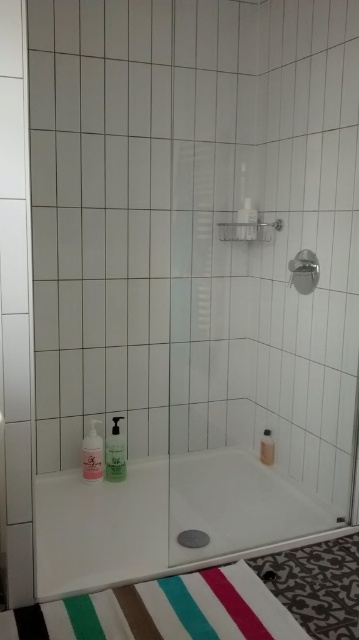
Is white glossy bathtub at lower center behind metallic silver showerhead at upper right?

That is False.

Does white glossy bathtub at lower center have a lesser width compared to metallic silver showerhead at upper right?

Incorrect, white glossy bathtub at lower center's width is not less than metallic silver showerhead at upper right's.

Is point (212, 532) behind point (300, 256)?

No.

The width and height of the screenshot is (359, 640). Identify the location of white glossy bathtub at lower center. (166, 518).

Does translucent plastic soap dispenser at lower left appear under translucent plastic soap dispenser at lower center?

Incorrect, translucent plastic soap dispenser at lower left is not positioned below translucent plastic soap dispenser at lower center.

Does point (89, 433) come closer to viewer compared to point (267, 445)?

Yes, point (89, 433) is in front of point (267, 445).

Identify the location of translucent plastic soap dispenser at lower left. This screenshot has width=359, height=640. [x=91, y=452].

Between metallic silver showerhead at upper right and translucent plastic soap dispenser at lower center, which one is positioned lower?

translucent plastic soap dispenser at lower center is below.

Between metallic silver showerhead at upper right and translucent plastic soap dispenser at lower center, which one appears on the right side from the viewer's perspective?

metallic silver showerhead at upper right is more to the right.

Between point (296, 256) and point (263, 435), which one is positioned behind?

Positioned behind is point (263, 435).

You are a GUI agent. You are given a task and a screenshot of the screen. Output one action in this format:
    pyautogui.click(x=<x>, y=<y>)
    Task: Click on the metallic silver showerhead at upper right
    The image size is (359, 640).
    Given the screenshot: What is the action you would take?
    pyautogui.click(x=304, y=272)